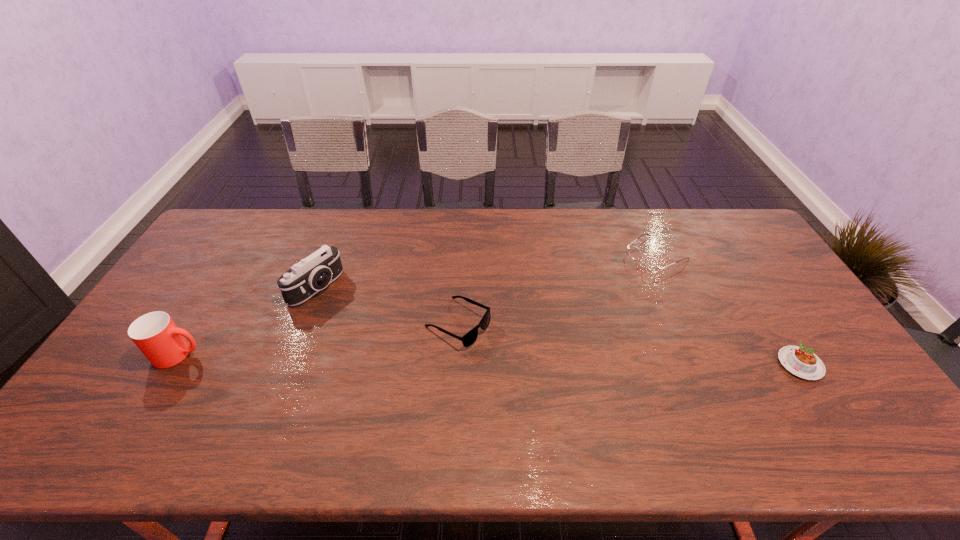
Find the location of a particular element. The image size is (960, 540). vacant space on the desktop that is between the cup and the rightmost object and is positioned through the lenses of the second object from right to left is located at coordinates (486, 359).

Image resolution: width=960 pixels, height=540 pixels. In order to click on free spot on the desktop that is between the cup and the rightmost object and is positioned on the front-facing side of the third object from left to right in this screenshot , I will do `click(526, 360)`.

Locate an element on the screen. The height and width of the screenshot is (540, 960). free spot on the desktop that is between the cup and the rightmost object and is positioned on the front lens of the fourth object from right to left is located at coordinates (433, 359).